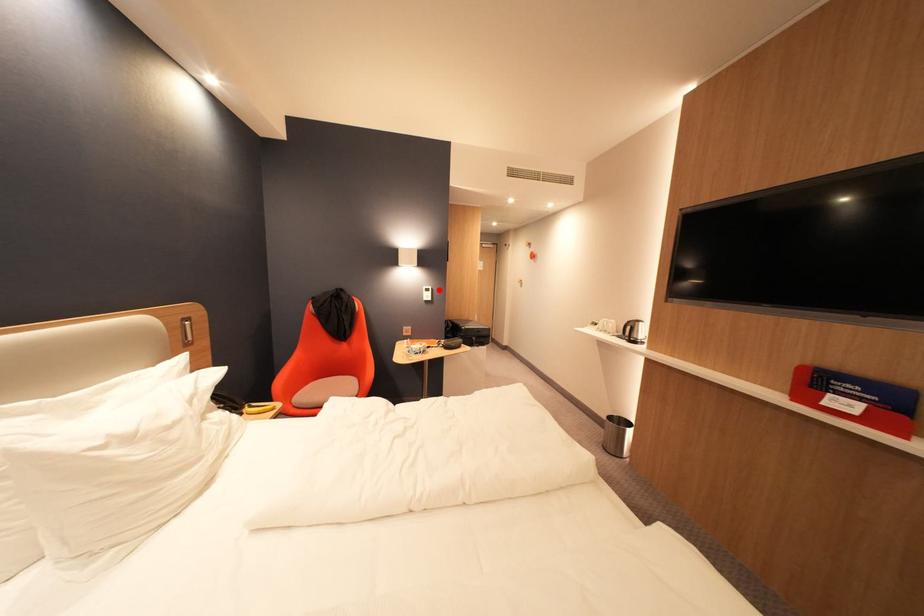
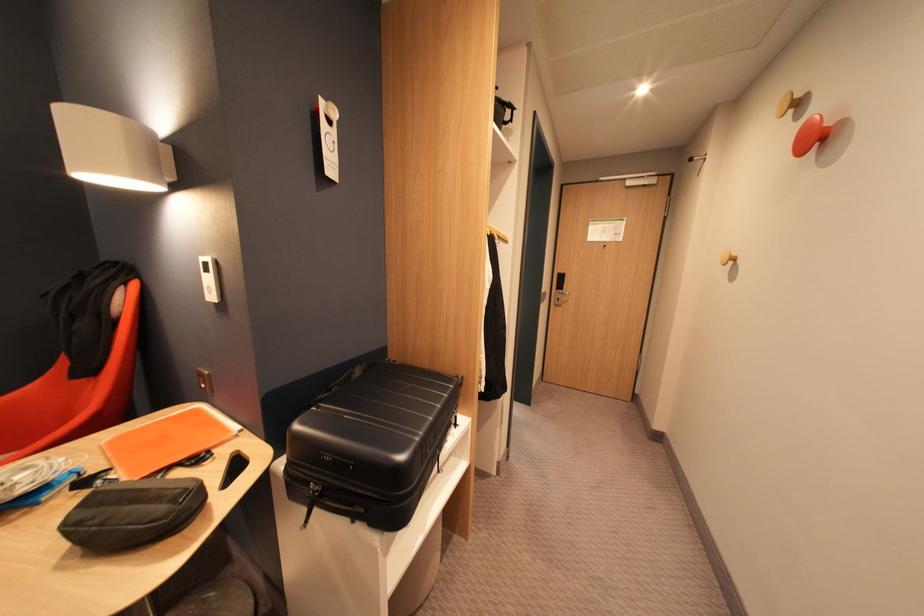
Where in the second image is the point corresponding to the highlighted location from the first image?

(216, 265)